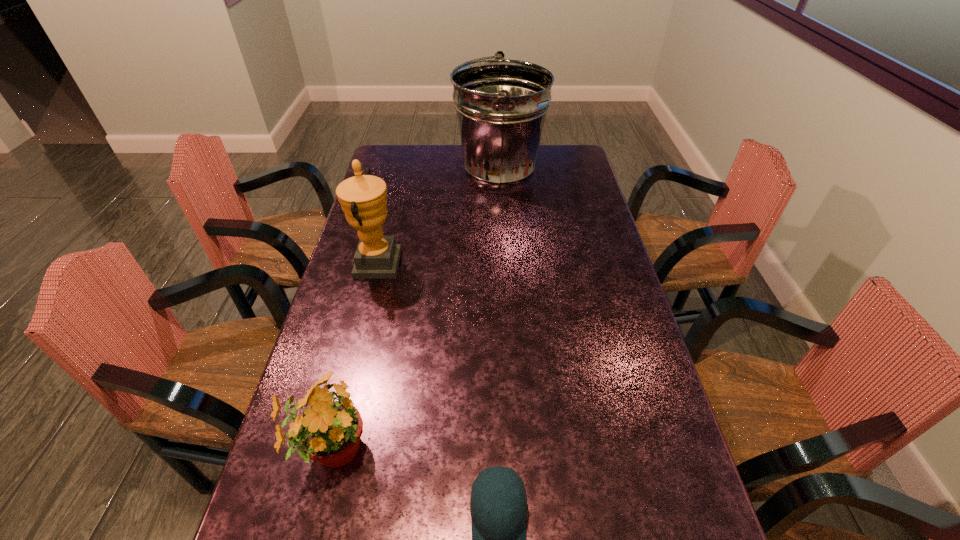
The width and height of the screenshot is (960, 540). I want to click on bucket, so click(501, 105).

Locate an element on the screen. the third nearest object is located at coordinates (363, 198).

The image size is (960, 540). Identify the location of flowerpot. (330, 431).

Identify the location of vacant space located 0.290m on the left of the bucket. The height and width of the screenshot is (540, 960). (384, 172).

Where is `free region located at the front of the award with handles`? This screenshot has width=960, height=540. free region located at the front of the award with handles is located at coordinates (483, 265).

In order to click on vacant space located 0.350m on the right of the second shortest object in this screenshot , I will do `click(528, 450)`.

Locate an element on the screen. The height and width of the screenshot is (540, 960). object located at the far edge is located at coordinates (501, 105).

This screenshot has height=540, width=960. What are the coordinates of `award at the left edge` in the screenshot? It's located at (363, 198).

Find the location of a particular element. The width and height of the screenshot is (960, 540). flowerpot that is at the left edge is located at coordinates (330, 431).

The height and width of the screenshot is (540, 960). Find the location of `vacant region at the far edge of the desktop`. vacant region at the far edge of the desktop is located at coordinates (450, 146).